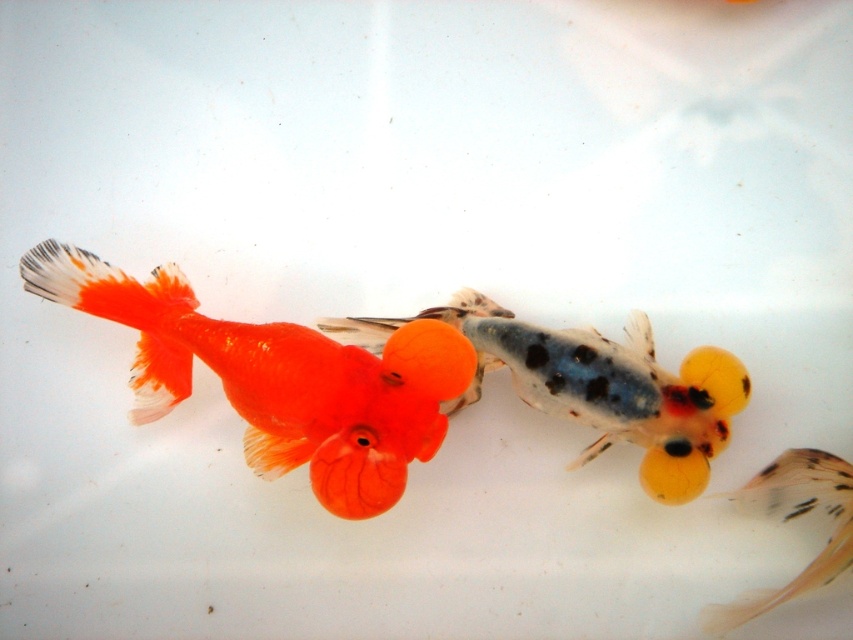
You are standing in front of an aquarium and want to know how far the point at coordinates point (380,378) is from you. Can you determine the distance?

The distance between point (380,378) and the camera is 1.29 meters, so the point is 1.29 meters away from you.

You are an aquarium maintenance worker who needs to clean the tank. You see the shiny orange goldfish at left and the translucent orange goldfish at center. Which fish is closer to the left side of the tank?

The shiny orange goldfish at left is closer to the left side of the tank since it is positioned to the left of the translucent orange goldfish at center.

You are an aquarist observing two fish in a tank. You see the shiny orange goldfish at left and the translucent orange fish at lower right. Which fish is positioned more to the right side of the tank?

The translucent orange fish at lower right is positioned more to the right side of the tank compared to the shiny orange goldfish at left.